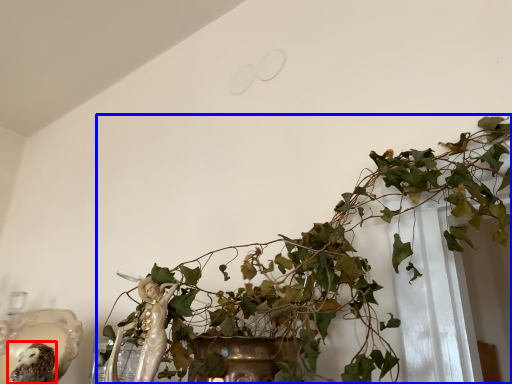
Question: Which object appears closest to the camera in this image, animal (highlighted by a red box) or houseplant (highlighted by a blue box)?

Choices:
 (A) animal
 (B) houseplant

Answer: (B)